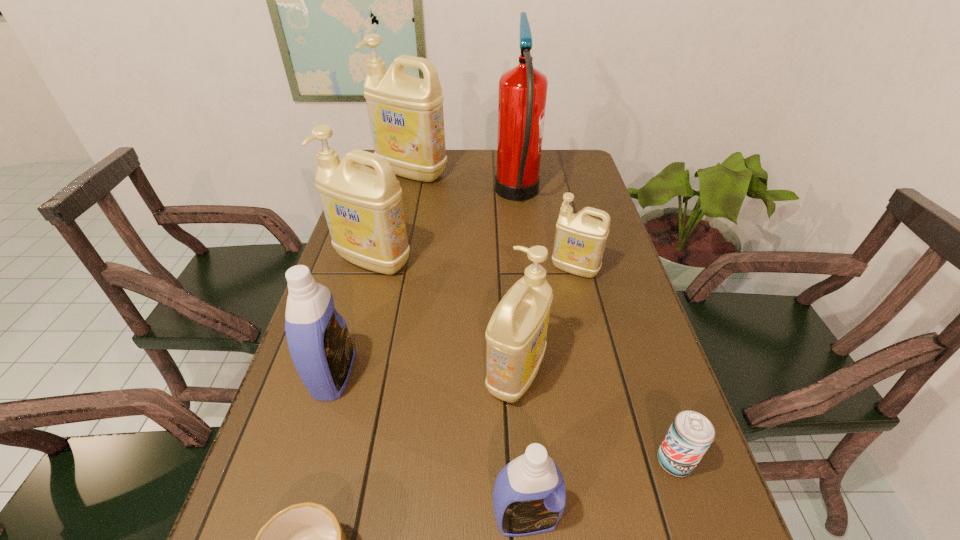
Where is `the rightmost detergent`? The image size is (960, 540). the rightmost detergent is located at coordinates (580, 240).

This screenshot has width=960, height=540. Identify the location of the nearest detergent. (529, 496).

Identify the location of the nearer blue detergent. This screenshot has width=960, height=540. (529, 496).

Identify the location of the seventh farthest object. (690, 435).

At what (x,y) coordinates should I click in order to perform the action: click on beer can. Please return your answer as a coordinate pair (x, y). Looking at the image, I should click on (690, 435).

Locate an element on the screen. This screenshot has height=540, width=960. free space located 0.180m on the right of the fire extinguisher is located at coordinates (592, 196).

The height and width of the screenshot is (540, 960). What are the coordinates of `vacant space located on the front of the tallest detergent` in the screenshot? It's located at (397, 235).

I want to click on vacant region located 0.170m on the right of the third tallest object, so click(x=472, y=261).

Where is `vacant space located 0.390m on the left of the second beige detergent from right to left`? This screenshot has width=960, height=540. vacant space located 0.390m on the left of the second beige detergent from right to left is located at coordinates (305, 374).

This screenshot has width=960, height=540. I want to click on free spot located 0.190m on the back of the left blue detergent, so click(359, 291).